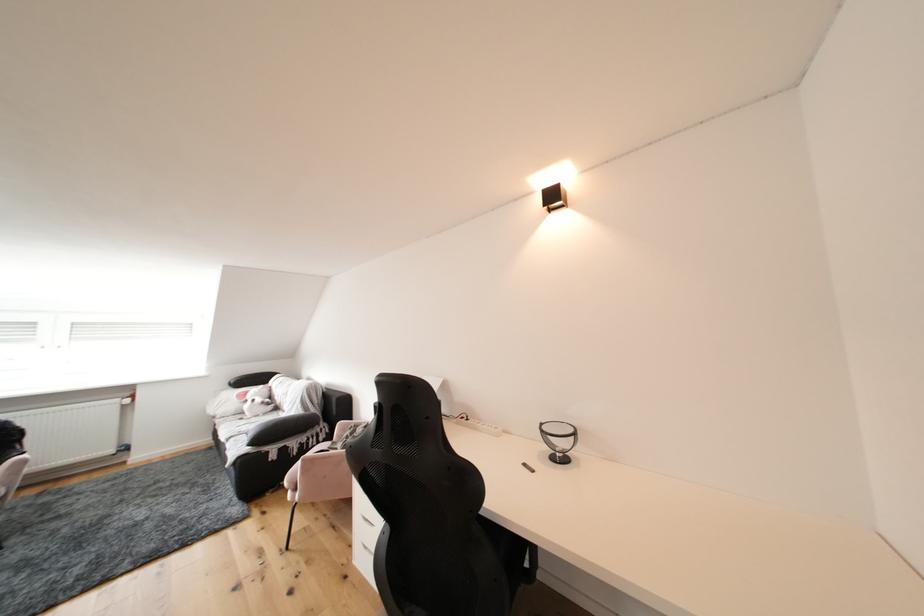
Where would you lift the dark grey pillow? Please return your answer as a coordinate pair (x, y).

(281, 428)